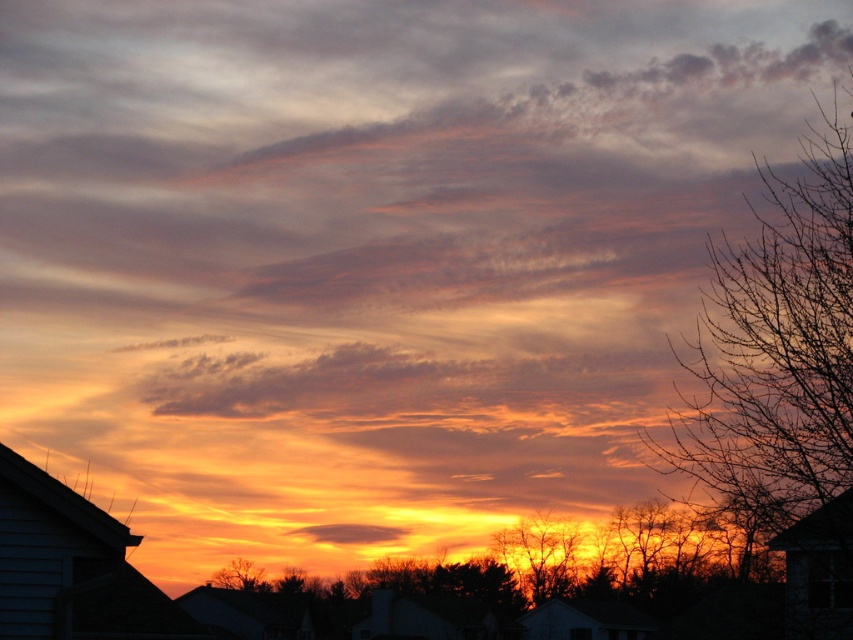
You are an artist trying to paint the sunset scene. You notice the silvery branches at upper right and the brown textured tree at lower center. Which of these two objects would you paint first to ensure proper layering based on their heights?

Since the silvery branches at upper right is much taller than the brown textured tree at lower center, you should paint the brown textured tree at lower center first, then the silvery branches at upper right to maintain the correct spatial relationship.